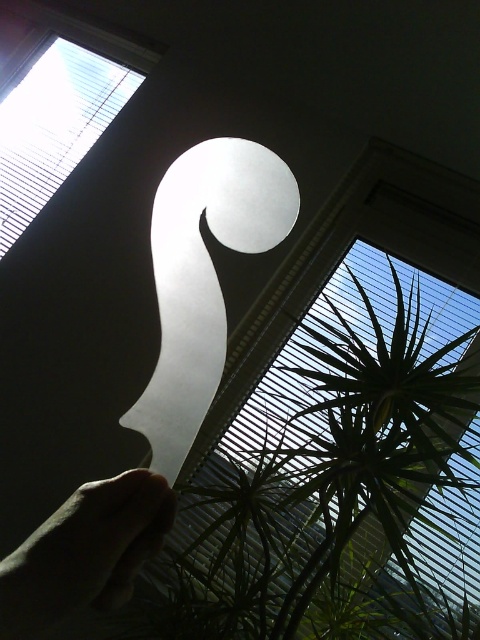
Question: Which point is closer to the camera taking this photo?

Choices:
 (A) (x=386, y=253)
 (B) (x=38, y=81)
 (C) (x=55, y=616)

Answer: (C)

Question: From the image, what is the correct spatial relationship of green translucent blind at upper center in relation to white matte blind at upper left?

Choices:
 (A) below
 (B) above

Answer: (A)

Question: In this image, where is skinny flesh-toned hand at lower left located relative to white matte blind at upper left?

Choices:
 (A) above
 (B) below

Answer: (B)

Question: Which object is farther from the camera taking this photo?

Choices:
 (A) green translucent blind at upper center
 (B) white matte blind at upper left

Answer: (B)

Question: Which point is closer to the camera?

Choices:
 (A) green translucent blind at upper center
 (B) skinny flesh-toned hand at lower left

Answer: (B)

Question: Does skinny flesh-toned hand at lower left appear on the right side of white matte blind at upper left?

Choices:
 (A) yes
 (B) no

Answer: (A)